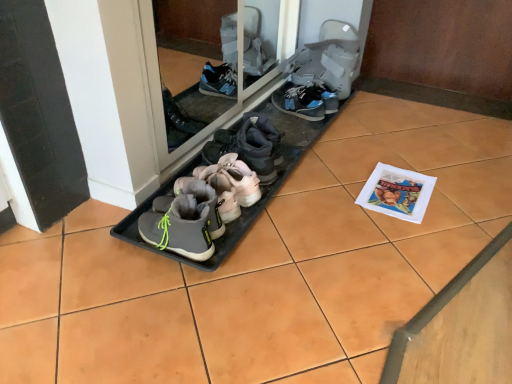
Locate an element on the screen. free location in front of gray suede sneaker at center, which appears as the second footwear when viewed from the back is located at coordinates (298, 128).